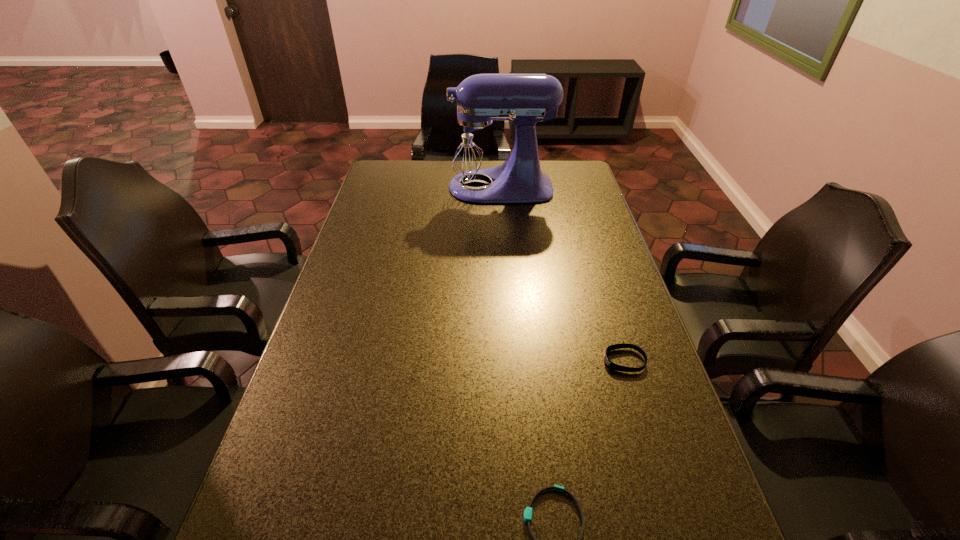
This screenshot has width=960, height=540. What are the coordinates of `mixer` in the screenshot? It's located at (475, 146).

Identify the location of the farthest object. (475, 146).

Identify the location of the rightmost object. Image resolution: width=960 pixels, height=540 pixels. (611, 365).

I want to click on the second shortest object, so click(x=611, y=365).

Find the location of a particular element. The height and width of the screenshot is (540, 960). vacant space located 0.260m at the mixing area of the farthest object is located at coordinates (374, 187).

At what (x,y) coordinates should I click in order to perform the action: click on vacant space located 0.130m at the mixing area of the farthest object. Please return your answer as a coordinate pair (x, y). Looking at the image, I should click on (408, 187).

Locate an element on the screen. blank space located 0.240m at the mixing area of the farthest object is located at coordinates (379, 187).

You are a GUI agent. You are given a task and a screenshot of the screen. Output one action in this format:
    pyautogui.click(x=<x>, y=<y>)
    Task: Click on the vacant position located 0.080m on the display of the farther wristband
    This screenshot has height=540, width=960.
    Given the screenshot: What is the action you would take?
    pyautogui.click(x=571, y=361)

This screenshot has width=960, height=540. I want to click on free point located 0.260m on the display of the farther wristband, so click(x=498, y=361).

At what (x,y) coordinates should I click in order to perform the action: click on vacant space located 0.380m on the display of the farther wristband. Please return your answer as a coordinate pair (x, y). The width and height of the screenshot is (960, 540). Looking at the image, I should click on (449, 361).